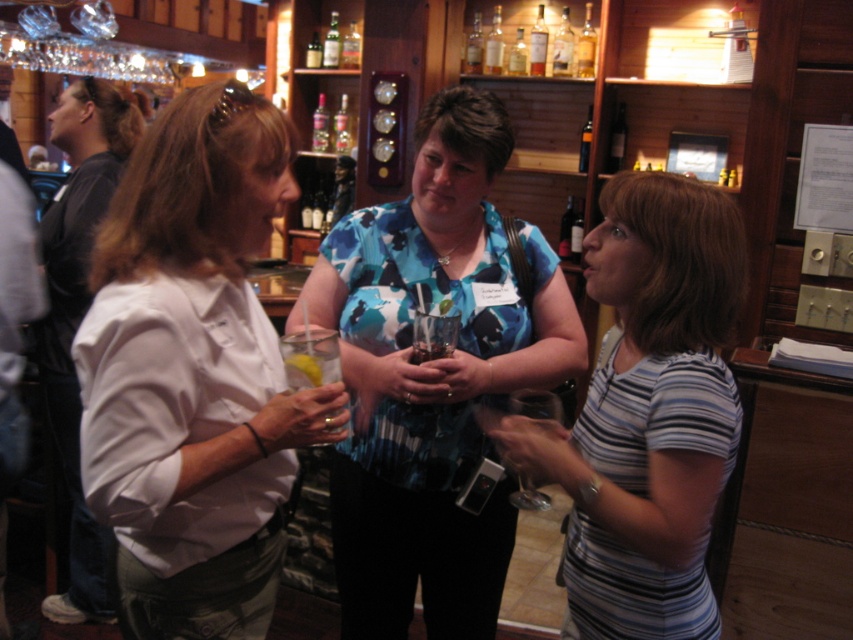
Question: Which object appears closest to the camera in this image?

Choices:
 (A) amber glass bottle at center
 (B) striped cotton shirt at center
 (C) translucent glass bottle at center

Answer: (B)

Question: Can you confirm if white matte shirt at center is thinner than striped cotton shirt at center?

Choices:
 (A) no
 (B) yes

Answer: (B)

Question: Does transparent glass wine glass at center come in front of amber glass bottle at center?

Choices:
 (A) yes
 (B) no

Answer: (A)

Question: Which of these objects is positioned closest to the amber glass bottle at center?

Choices:
 (A) white shirt at left
 (B) blue printed blouse at center

Answer: (A)

Question: Which point is closer to the camera?

Choices:
 (A) (68, 134)
 (B) (199, 134)

Answer: (B)

Question: Can you confirm if white matte shirt at center is positioned to the right of striped cotton shirt at center?

Choices:
 (A) no
 (B) yes

Answer: (A)